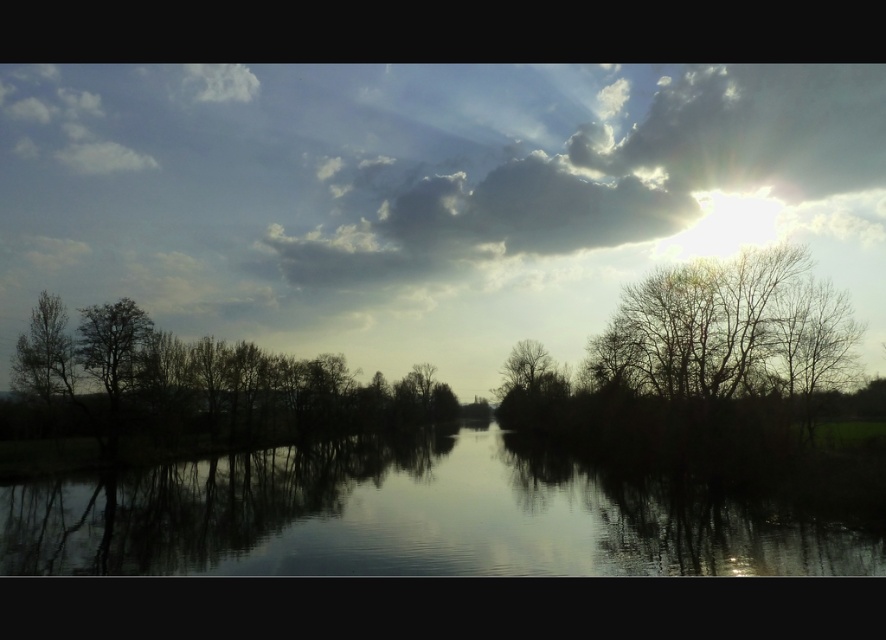
You are standing at the edge of the river and looking towards the upper center. What do you see at the coordinates point (601, 173)?

At point (601, 173), you see the cloudy sky at upper center.

You are standing in the landscape scene and want to take a photo of the silhouette leafless tree at left. To ensure it is centered in your camera frame, where should you position the tree relative to your viewfinder? Please provide coordinates as a point in the format of a pair of numbers between 0 and 1, where 0 is the minimum and 1 is the maximum for both x and y axes.

The silhouette leafless tree at left is located at point (190, 384), so to center it in your camera frame, position the tree at coordinates (190, 384).